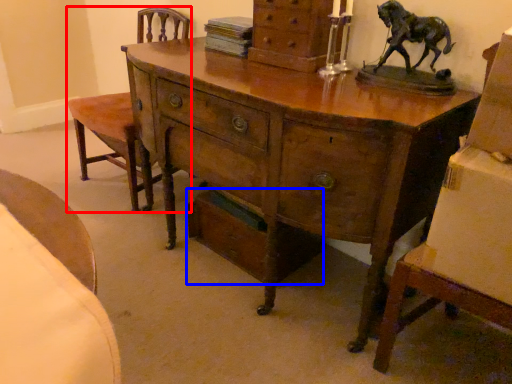
Question: Which of the following is the farthest to the observer, armchair (highlighted by a red box) or drawer (highlighted by a blue box)?

Choices:
 (A) armchair
 (B) drawer

Answer: (A)